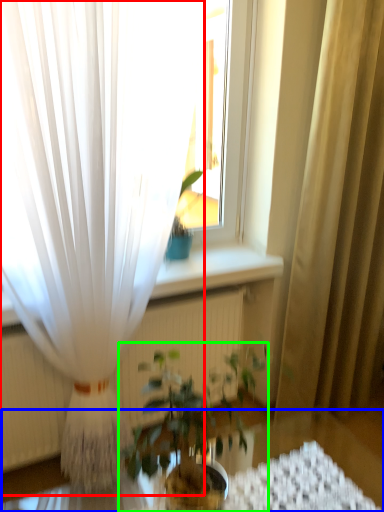
Question: Estimate the real-world distances between objects in this image. Which object is farther from curtain (highlighted by a red box), round table (highlighted by a blue box) or houseplant (highlighted by a green box)?

Choices:
 (A) round table
 (B) houseplant

Answer: (A)